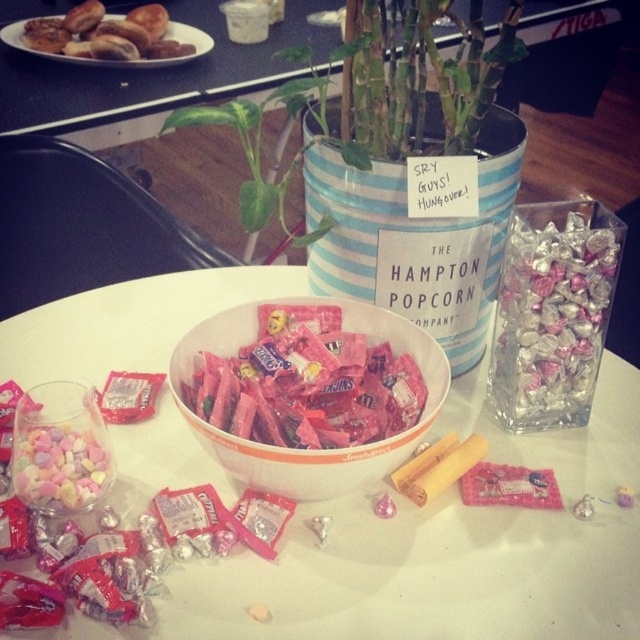
Question: Estimate the real-world distances between objects in this image. Which object is closer to the pastel matte heart-shaped candies at lower left?

Choices:
 (A) pink matte candy bowl at center
 (B) silver foil wrapped chocolates at right

Answer: (A)

Question: Is silver foil wrapped chocolates at right above pink matte candy bowl at center?

Choices:
 (A) no
 (B) yes

Answer: (B)

Question: Can you confirm if white glossy table at center is thinner than golden brown pastries at upper left?

Choices:
 (A) yes
 (B) no

Answer: (B)

Question: Which of the following is the farthest from the observer?

Choices:
 (A) golden brown pastries at upper left
 (B) pink matte candy bowl at center
 (C) pastel matte heart-shaped candies at lower left

Answer: (A)

Question: Which of the following is the closest to the observer?

Choices:
 (A) (170, 33)
 (B) (342, 468)
 (C) (22, 440)

Answer: (B)

Question: Is white glossy table at center closer to the viewer compared to pink matte candy bowl at center?

Choices:
 (A) yes
 (B) no

Answer: (B)